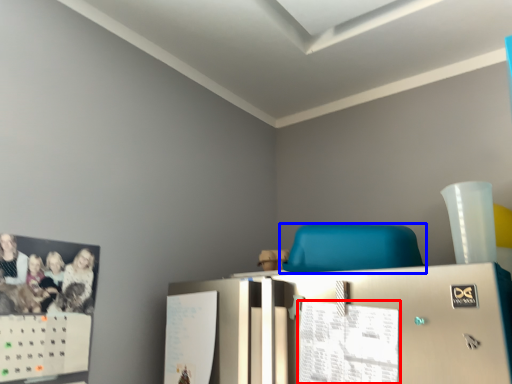
Question: Which of the following is the farthest to the observer, paper (highlighted by a red box) or furniture (highlighted by a blue box)?

Choices:
 (A) paper
 (B) furniture

Answer: (B)